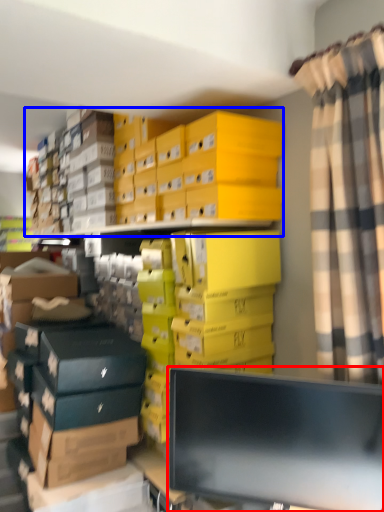
Question: Among these objects, which one is farthest to the camera, computer monitor (highlighted by a red box) or storage box (highlighted by a blue box)?

Choices:
 (A) computer monitor
 (B) storage box

Answer: (B)